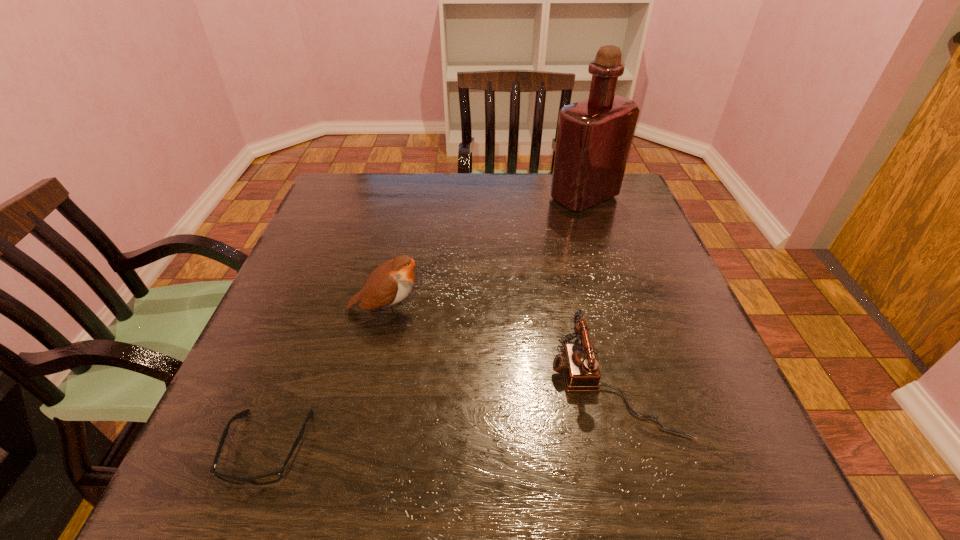
You are a GUI agent. You are given a task and a screenshot of the screen. Output one action in this format:
    pyautogui.click(x=<x>, y=<y>)
    Task: Click on the farthest object
    
    Given the screenshot: What is the action you would take?
    pyautogui.click(x=594, y=136)

The image size is (960, 540). I want to click on liquor, so click(594, 136).

Image resolution: width=960 pixels, height=540 pixels. I want to click on the second farthest object, so click(x=390, y=283).

Image resolution: width=960 pixels, height=540 pixels. I want to click on bird, so click(390, 283).

Locate an element on the screen. Image resolution: width=960 pixels, height=540 pixels. telephone is located at coordinates (578, 363).

The width and height of the screenshot is (960, 540). Find the location of `the shortest object`. the shortest object is located at coordinates (270, 478).

You are a GUI agent. You are given a task and a screenshot of the screen. Output one action in this format:
    pyautogui.click(x=<x>, y=<y>)
    Task: Click on the vacant area situated on the left of the liquor
    
    Given the screenshot: What is the action you would take?
    pyautogui.click(x=513, y=198)

This screenshot has width=960, height=540. Identify the location of free location located at the face of the third nearest object. (579, 309).

Locate an element on the screen. The image size is (960, 540). vacant area situated on the dial of the second shortest object is located at coordinates (503, 384).

Find the location of `vacant space situated 0.130m on the dial of the second shortest object`. vacant space situated 0.130m on the dial of the second shortest object is located at coordinates (480, 384).